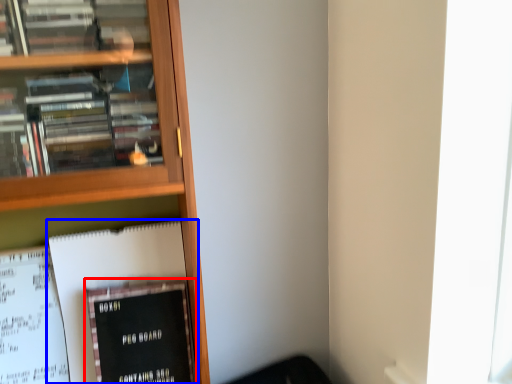
Question: Which object is further to the camera taking this photo, book (highlighted by a red box) or book (highlighted by a blue box)?

Choices:
 (A) book
 (B) book

Answer: (B)